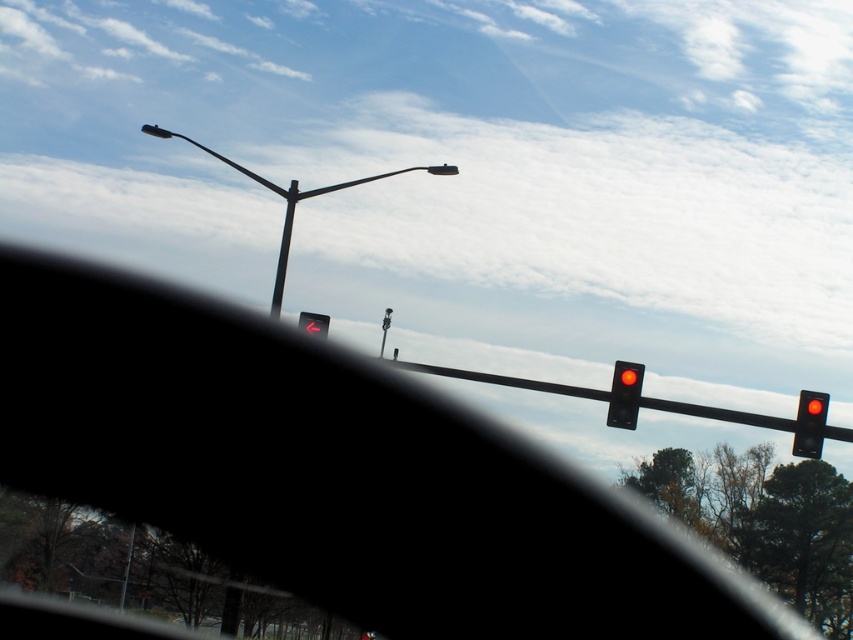
Question: Does matte black street light at upper left appear over matte glass traffic light at center right?

Choices:
 (A) yes
 (B) no

Answer: (A)

Question: Which point appears closest to the camera in this image?

Choices:
 (A) (283, 241)
 (B) (306, 326)

Answer: (B)

Question: Does transparent glass windshield at center appear under matte black street light at upper left?

Choices:
 (A) yes
 (B) no

Answer: (A)

Question: From the image, what is the correct spatial relationship of matte black traffic light at right in relation to red matte traffic light at center?

Choices:
 (A) below
 (B) above

Answer: (A)

Question: Estimate the real-world distances between objects in this image. Which object is closer to the matte black street light at upper left?

Choices:
 (A) metallic pole at center
 (B) transparent glass windshield at center
 (C) red matte traffic light at center
 (D) matte black traffic light at right

Answer: (A)

Question: Which point is farther to the camera?

Choices:
 (A) metallic pole at center
 (B) red matte traffic light at center

Answer: (A)